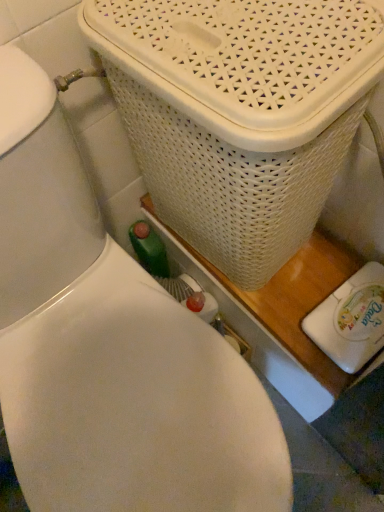
You are a GUI agent. You are given a task and a screenshot of the screen. Output one action in this format:
    pyautogui.click(x=<x>, y=<y>)
    Task: Click on the vacant space in between white woven basket at upper right and white plastic toilet brush at lower right
    
    Given the screenshot: What is the action you would take?
    pyautogui.click(x=309, y=297)